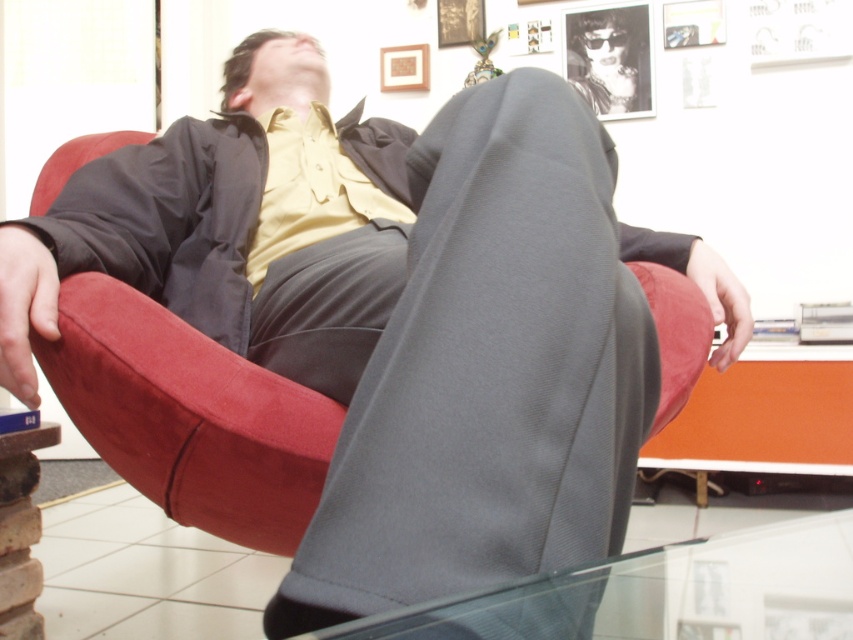
Question: In this image, where is velvet red bean bag chair at center located relative to transparent glass table at lower center?

Choices:
 (A) right
 (B) left

Answer: (B)

Question: Which point appears farthest from the camera in this image?

Choices:
 (A) (428, 634)
 (B) (109, 353)

Answer: (B)

Question: Which point is closer to the camera?

Choices:
 (A) velvet red bean bag chair at center
 (B) transparent glass table at lower center

Answer: (B)

Question: Does velvet red bean bag chair at center have a smaller size compared to transparent glass table at lower center?

Choices:
 (A) yes
 (B) no

Answer: (A)

Question: Can you confirm if velvet red bean bag chair at center is thinner than transparent glass table at lower center?

Choices:
 (A) yes
 (B) no

Answer: (A)